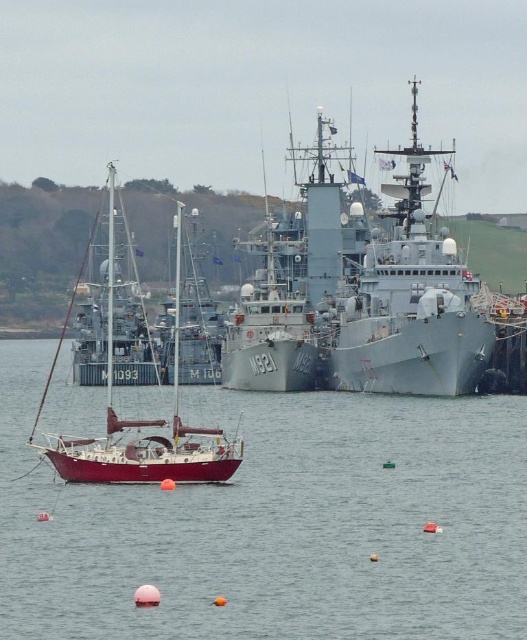
Question: Does smooth gray water at center appear on the right side of shiny red sailboat at center?

Choices:
 (A) no
 (B) yes

Answer: (B)

Question: Is gray metallic ship at center to the right of shiny red sailboat at center from the viewer's perspective?

Choices:
 (A) no
 (B) yes

Answer: (B)

Question: Which of the following is the closest to the observer?

Choices:
 (A) (112, 467)
 (B) (422, 636)
 (C) (401, 198)

Answer: (B)

Question: Does smooth gray water at center have a smaller size compared to shiny red sailboat at center?

Choices:
 (A) no
 (B) yes

Answer: (B)

Question: Which object is positioned farthest from the gray metallic ship at center?

Choices:
 (A) shiny red sailboat at center
 (B) smooth gray water at center

Answer: (A)

Question: Which of the following is the closest to the observer?

Choices:
 (A) shiny red sailboat at center
 (B) smooth gray water at center

Answer: (B)